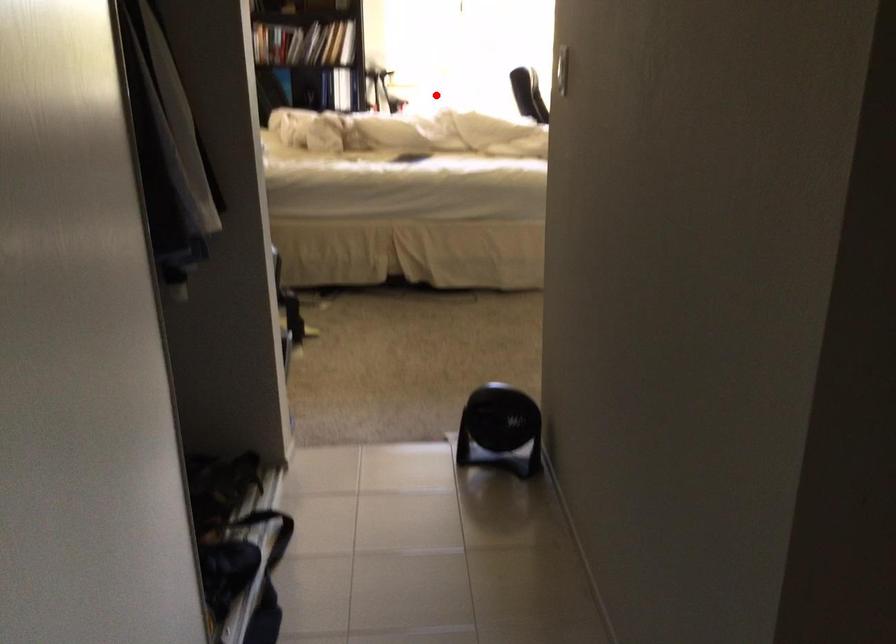
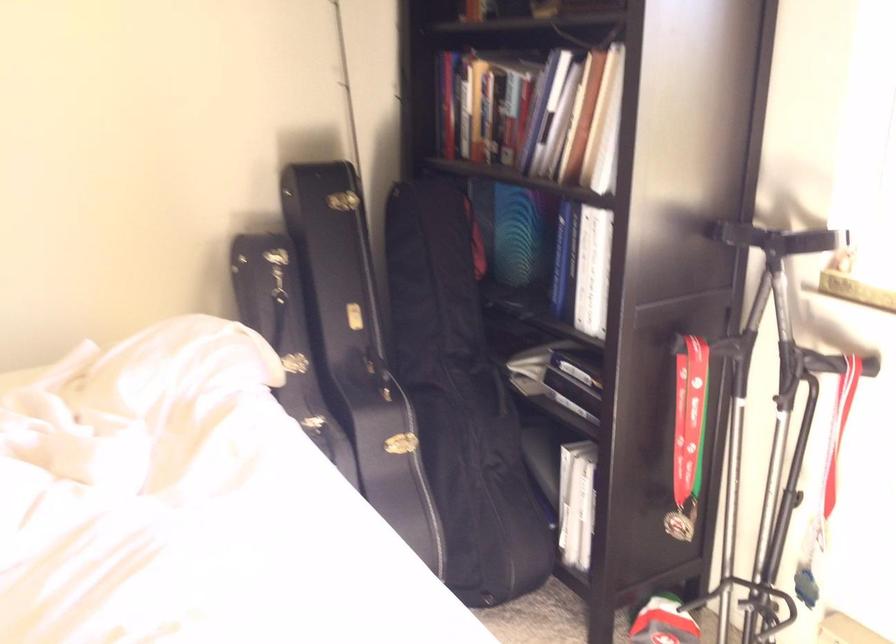
Question: I am providing you with two images of the same scene from different viewpoints. A red point is shown in image1. For the corresponding object point in image2, is it positioned nearer or farther from the camera?

Choices:
 (A) Nearer
 (B) Farther

Answer: (A)